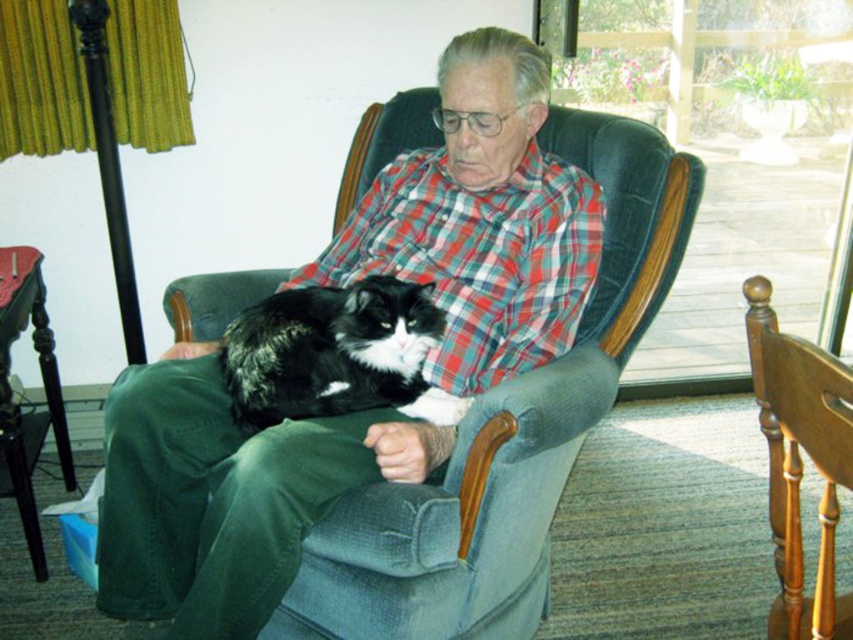
Question: Does plaid cotton shirt at center appear on the right side of wooden chair at center?

Choices:
 (A) yes
 (B) no

Answer: (B)

Question: Which of these objects is positioned closest to the plaid cotton shirt at center?

Choices:
 (A) wooden chair at center
 (B) black fluffy cat at center

Answer: (B)

Question: Is red plaid shirt at center thinner than wooden chair at center?

Choices:
 (A) yes
 (B) no

Answer: (B)

Question: Which of the following is the farthest from the observer?

Choices:
 (A) red plaid shirt at center
 (B) black fluffy cat at center
 (C) wooden chair at center
 (D) plaid cotton shirt at center

Answer: (A)

Question: Is plaid cotton shirt at center below black fluffy cat at center?

Choices:
 (A) yes
 (B) no

Answer: (B)

Question: Estimate the real-world distances between objects in this image. Which object is farther from the black fluffy cat at center?

Choices:
 (A) plaid cotton shirt at center
 (B) wooden chair at center

Answer: (B)